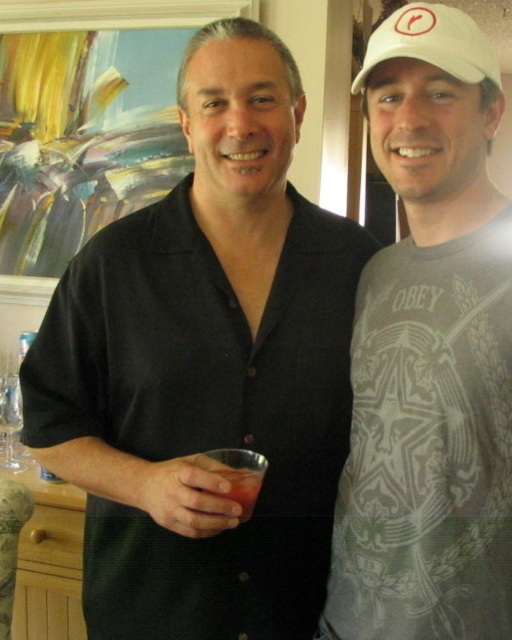
Question: Considering the relative positions of gray matte t-shirt at center and white fabric cap at upper right in the image provided, where is gray matte t-shirt at center located with respect to white fabric cap at upper right?

Choices:
 (A) right
 (B) left

Answer: (A)

Question: Among these objects, which one is nearest to the camera?

Choices:
 (A) black cotton shirt at center
 (B) white fabric cap at upper right

Answer: (B)

Question: Which of the following is the farthest from the observer?

Choices:
 (A) clear glass wine glass at lower left
 (B) translucent glass drink at center
 (C) white fabric cap at upper right

Answer: (A)

Question: Can you confirm if gray matte t-shirt at center is bigger than translucent glass drink at center?

Choices:
 (A) no
 (B) yes

Answer: (B)

Question: Among these objects, which one is nearest to the camera?

Choices:
 (A) gray matte t-shirt at center
 (B) clear glass wine glass at lower left

Answer: (A)

Question: Where is black cotton shirt at center located in relation to white fabric cap at upper right in the image?

Choices:
 (A) left
 (B) right

Answer: (A)